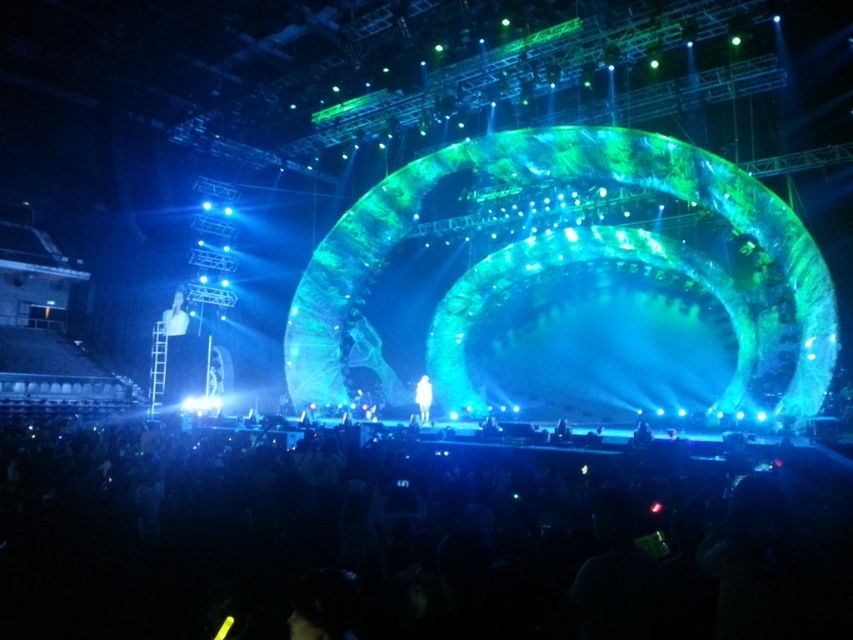
You are a photographer standing in the audience at a concert. You see the white glossy figure at upper left on stage. You want to take a clear photo of it. Do you think you can capture it clearly from your current position? Explain your reasoning.

The white glossy figure at upper left is 337.44 feet away from the viewer. This distance is quite large, so capturing clear details might be challenging without a high zoom lens or professional equipment. The figure might appear small or blurry in the photo.

You are at a concert and notice two figures on stage. The first is a white glossy figure at upper left and the second is a translucent white figure at center. From your seat, which figure is positioned to the left side?

The white glossy figure at upper left is positioned to the left of the translucent white figure at center, so the white glossy figure at upper left is on the left side.